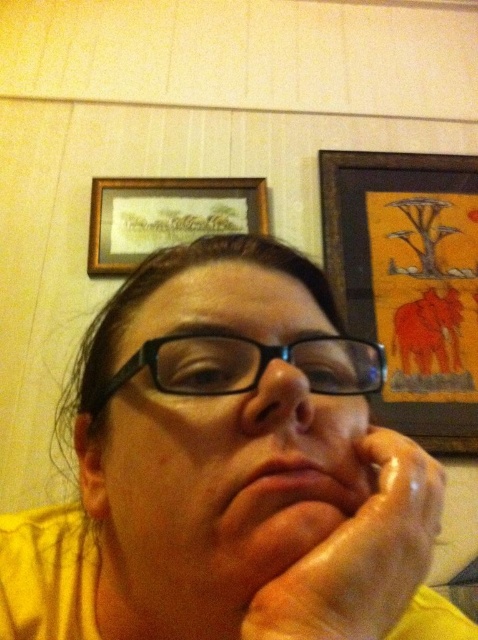
Is matte black glasses at center wider than matte skin at center?

Indeed, matte black glasses at center has a greater width compared to matte skin at center.

Which is behind, point (358, 499) or point (290, 500)?

The point (358, 499) is behind.

Which is behind, point (271, 460) or point (278, 536)?

The point (271, 460) is behind.

Where is `matte black glasses at center`? matte black glasses at center is located at coordinates (225, 484).

In the scene shown: Which is above, wooden frame at upper center or matte skin nose at center?

Positioned higher is wooden frame at upper center.

Is wooden frame at upper center below matte skin nose at center?

No.

Is point (97, 214) positioned behind point (257, 396)?

That is True.

The height and width of the screenshot is (640, 478). I want to click on wooden frame at upper center, so click(x=166, y=216).

In the scene shown: Is yellow matte skin at center positioned behind dry skin at center?

Yes, yellow matte skin at center is further from the viewer.

Is yellow matte skin at center taller than dry skin at center?

Correct, yellow matte skin at center is much taller as dry skin at center.

Does point (78, 516) come farther from viewer compared to point (336, 604)?

That is True.

I want to click on yellow matte skin at center, so click(228, 472).